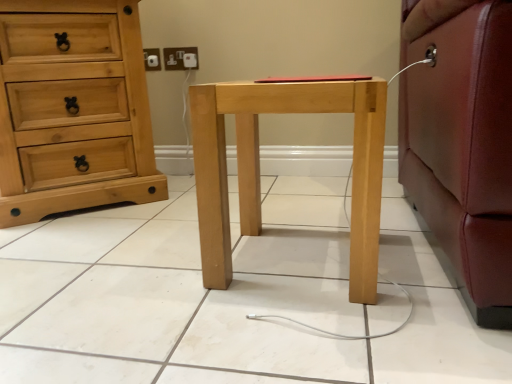
Question: Could natural wood chest of drawers at left be considered to be inside natural wood nightstand at center?

Choices:
 (A) no
 (B) yes

Answer: (A)

Question: Is natural wood nightstand at center facing away from natural wood chest of drawers at left?

Choices:
 (A) no
 (B) yes

Answer: (A)

Question: Does natural wood nightstand at center appear on the left side of natural wood chest of drawers at left?

Choices:
 (A) yes
 (B) no

Answer: (B)

Question: From the image's perspective, would you say natural wood nightstand at center is positioned over natural wood chest of drawers at left?

Choices:
 (A) no
 (B) yes

Answer: (A)

Question: From the image's perspective, is natural wood nightstand at center below natural wood chest of drawers at left?

Choices:
 (A) no
 (B) yes

Answer: (B)

Question: Is natural wood nightstand at center to the left or to the right of natural wood chest of drawers at left in the image?

Choices:
 (A) right
 (B) left

Answer: (A)

Question: Is point (209, 225) positioned closer to the camera than point (23, 215)?

Choices:
 (A) farther
 (B) closer

Answer: (B)

Question: Considering the positions of natural wood nightstand at center and natural wood chest of drawers at left in the image, is natural wood nightstand at center bigger or smaller than natural wood chest of drawers at left?

Choices:
 (A) big
 (B) small

Answer: (B)

Question: Considering the positions of natural wood nightstand at center and natural wood chest of drawers at left in the image, is natural wood nightstand at center taller or shorter than natural wood chest of drawers at left?

Choices:
 (A) short
 (B) tall

Answer: (A)

Question: Relative to natural wood nightstand at center, is natural wood chest of drawers at left in front or behind?

Choices:
 (A) front
 (B) behind

Answer: (B)

Question: Looking at their shapes, would you say natural wood chest of drawers at left is wider or thinner than natural wood nightstand at center?

Choices:
 (A) thin
 (B) wide

Answer: (B)

Question: Do you think natural wood chest of drawers at left is within natural wood nightstand at center, or outside of it?

Choices:
 (A) inside
 (B) outside

Answer: (B)

Question: Based on their sizes in the image, would you say natural wood chest of drawers at left is bigger or smaller than natural wood nightstand at center?

Choices:
 (A) small
 (B) big

Answer: (B)

Question: Considering the positions of white plastic electric outlet at upper center and natural wood chest of drawers at left in the image, is white plastic electric outlet at upper center bigger or smaller than natural wood chest of drawers at left?

Choices:
 (A) small
 (B) big

Answer: (A)

Question: Is white plastic electric outlet at upper center wider or thinner than natural wood chest of drawers at left?

Choices:
 (A) wide
 (B) thin

Answer: (B)